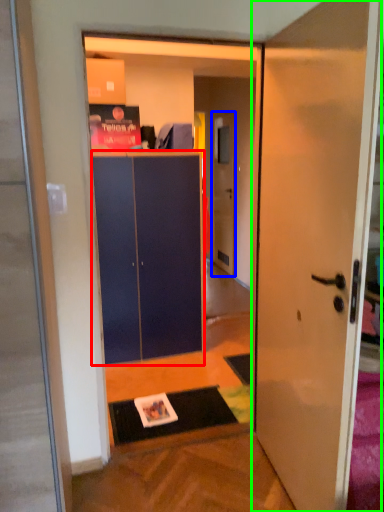
Question: Considering the real-world distances, which object is farthest from cabinetry (highlighted by a red box)? door (highlighted by a blue box) or door (highlighted by a green box)?

Choices:
 (A) door
 (B) door

Answer: (A)